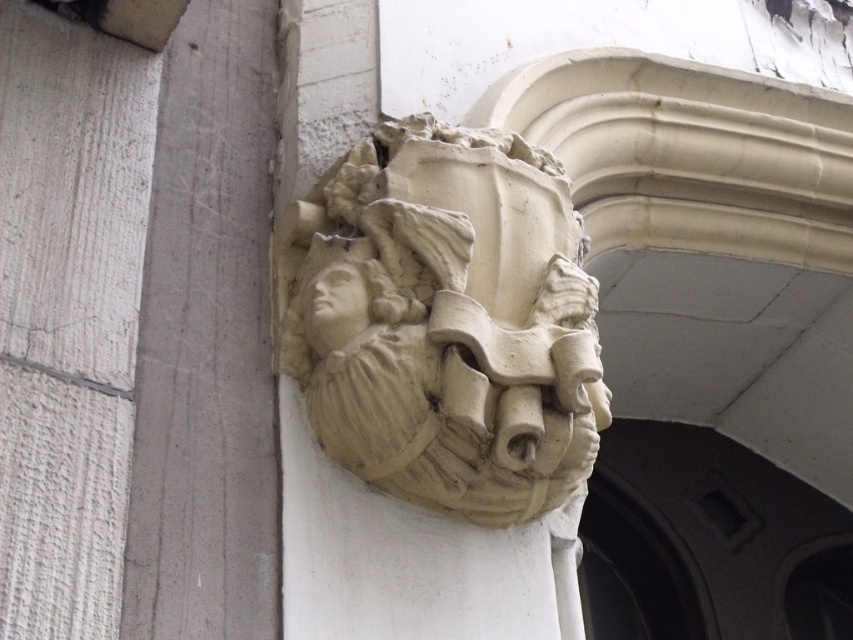
You are an art conservator examining the architectural detail. You notice two elements at the center of the image. Which one is bigger between the beige stone sculpture at center and the matte stone head at center?

The beige stone sculpture at center is larger in size than the matte stone head at center.

You are an architect examining the beige stone sculpture at center and the matte stone face at center in the image. Which object is taller?

The beige stone sculpture at center is taller than the matte stone face at center.

You are standing in front of an architectural detail and want to take a photo of the beige stone sculpture at center. If your camera can focus on objects up to 10 meters away, will it be able to capture the sculpture clearly?

The beige stone sculpture at center is 8.48 meters away from viewer. Since the camera can focus up to 10 meters, it will be able to capture the sculpture clearly.